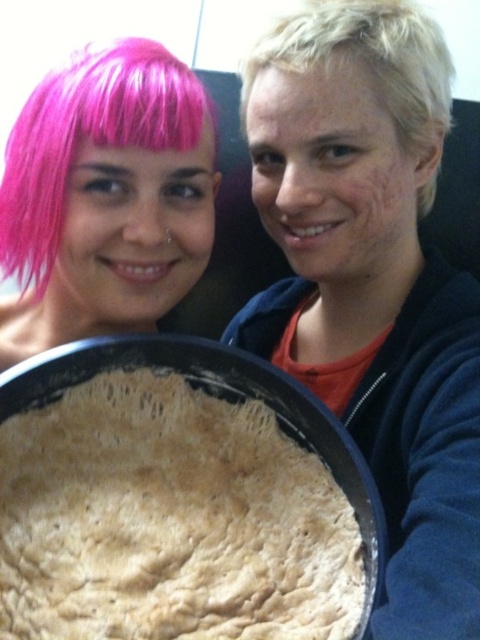
You are standing in a kitchen and see the brown crumbly dough at center. If you want to place it on a shelf that is at point 0.700, 0.300, would you need to move it left or right?

The brown crumbly dough at center is located at point [169,518]. The shelf is at [144,448]. Since the x coordinate of the dough is higher than the shelf, you need to move it to the left to reach the shelf.

You are a photographer setting up a shoot. You have to place a small prop between the brown crumbly dough at center and the blondehair at right. Based on their positions, where should you place the prop so it is between them?

The brown crumbly dough at center is below blondehair at right, so you should place the prop in the middle between them along the vertical axis.

You are standing in a kitchen and see a point marked at coordinates (169, 518). What object is located at that point?

The brown crumbly dough at center is located at point (169, 518).